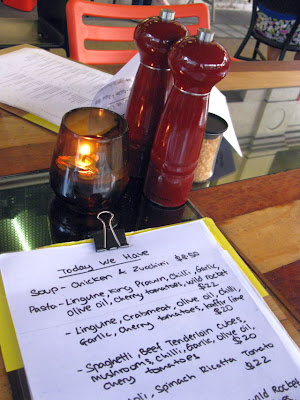
Locate an element on the screen. glass jar with black lid is located at coordinates (209, 152).